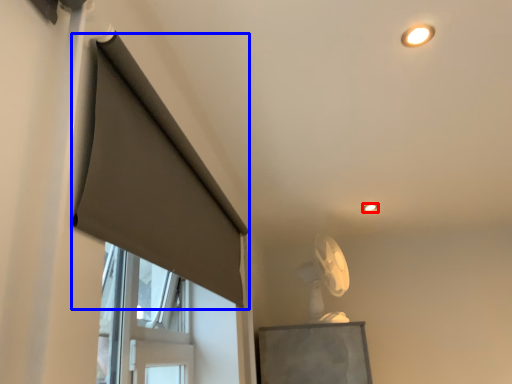
Question: Among these objects, which one is farthest to the camera, lighting (highlighted by a red box) or curtain (highlighted by a blue box)?

Choices:
 (A) lighting
 (B) curtain

Answer: (A)